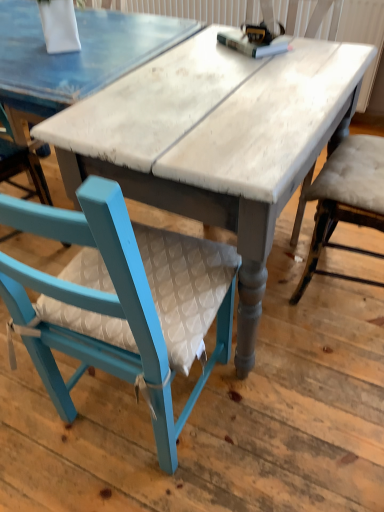
Question: Is teal painted wood chair at lower left inside the boundaries of white painted wood table at center, or outside?

Choices:
 (A) inside
 (B) outside

Answer: (B)

Question: From a real-world perspective, is teal painted wood chair at lower left positioned above or below white painted wood table at center?

Choices:
 (A) below
 (B) above

Answer: (B)

Question: Looking at the image, does teal painted wood chair at lower left seem bigger or smaller compared to white painted wood table at center?

Choices:
 (A) big
 (B) small

Answer: (B)

Question: Which is correct: white painted wood table at center is inside teal painted wood chair at lower left, or outside of it?

Choices:
 (A) inside
 (B) outside

Answer: (B)

Question: Considering their positions, is white painted wood table at center located in front of or behind teal painted wood chair at lower left?

Choices:
 (A) front
 (B) behind

Answer: (B)

Question: From a real-world perspective, is white painted wood table at center physically located above or below teal painted wood chair at lower left?

Choices:
 (A) above
 (B) below

Answer: (B)

Question: Is point (100, 105) positioned closer to the camera than point (223, 336)?

Choices:
 (A) farther
 (B) closer

Answer: (B)